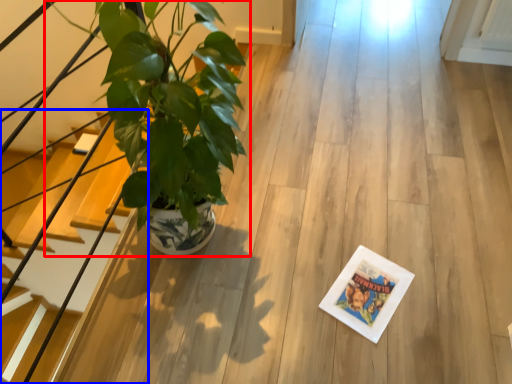
Question: Which object appears closest to the camera in this image, houseplant (highlighted by a red box) or stairs (highlighted by a blue box)?

Choices:
 (A) houseplant
 (B) stairs

Answer: (B)